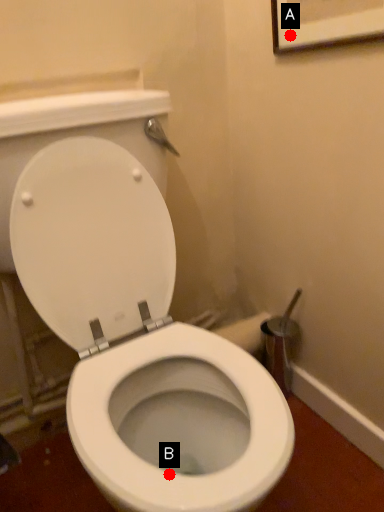
Question: Two points are circled on the image, labeled by A and B beside each circle. Among these points, which one is farthest from the camera?

Choices:
 (A) A is further
 (B) B is further

Answer: (A)